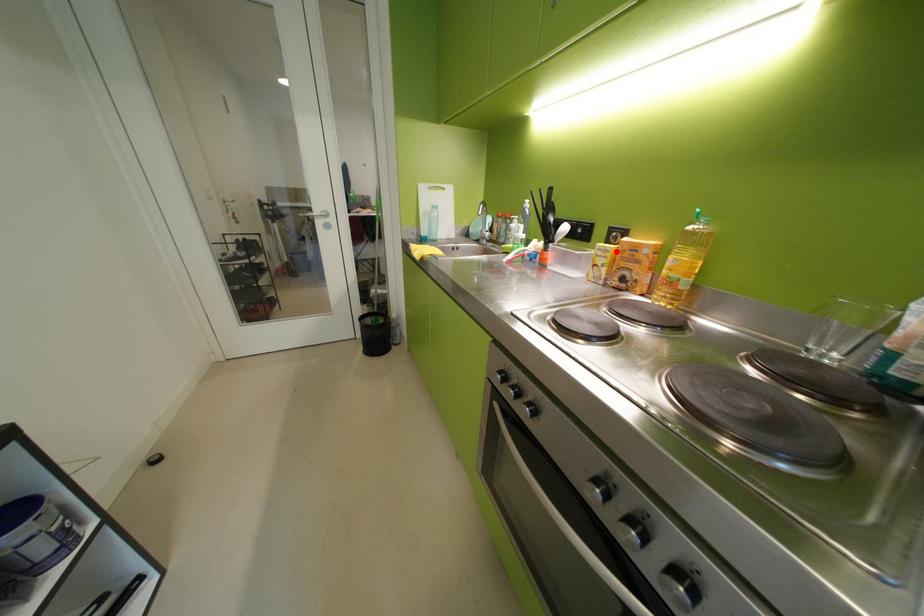
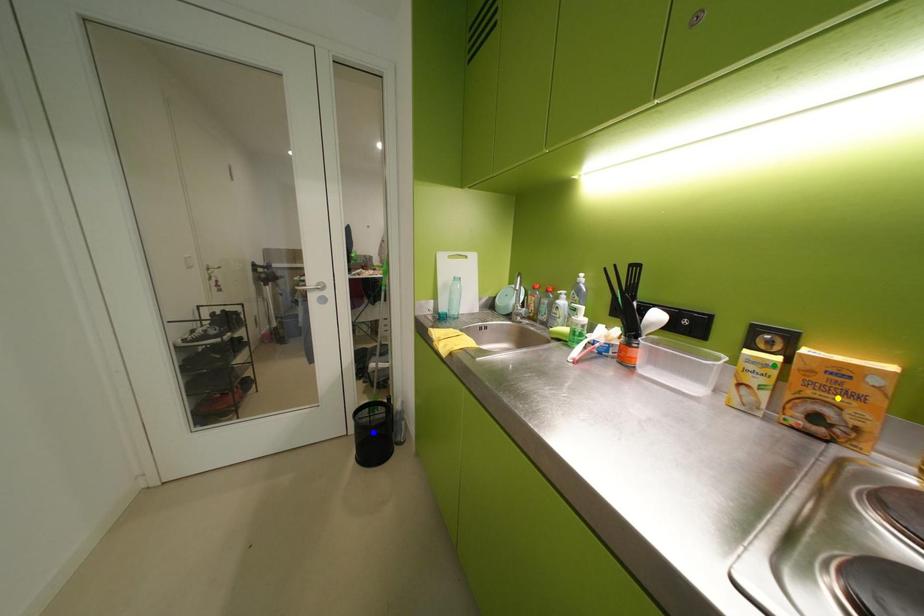
Question: I am providing you with two images of the same scene from different viewpoints. A red point is marked on the first image. You are given multiple points on the second image. In image 2, which mark is for the same physical point as the one in image 1?

Choices:
 (A) green point
 (B) yellow point
 (C) blue point

Answer: (A)